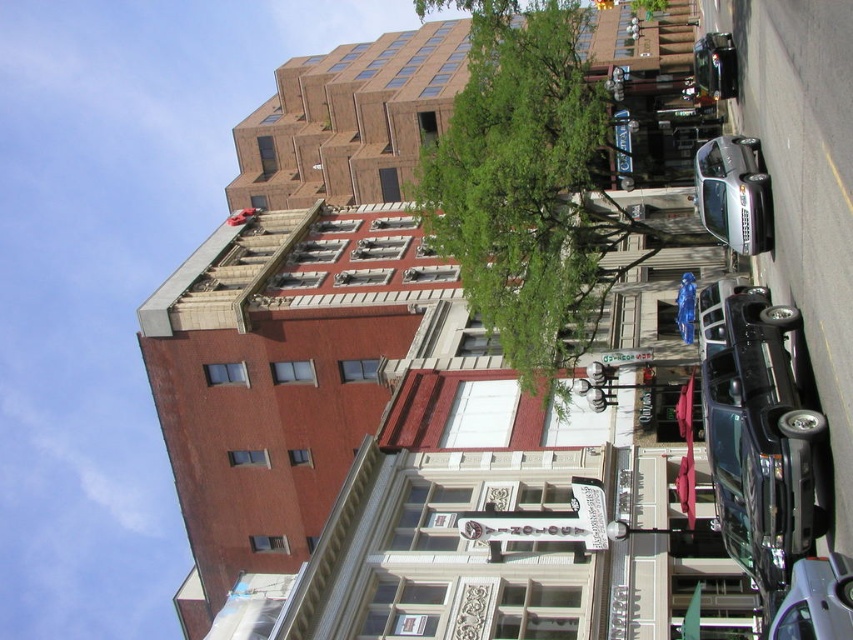
Question: Based on their relative distances, which object is nearer to the shiny black car at right?

Choices:
 (A) green leafy tree at center
 (B) silver metallic sedan at right

Answer: (B)

Question: Is shiny black car at right positioned before metallic silver sedan at lower right?

Choices:
 (A) no
 (B) yes

Answer: (A)

Question: Is green leafy tree at center to the left of shiny black car at right from the viewer's perspective?

Choices:
 (A) yes
 (B) no

Answer: (A)

Question: Which point is farther to the camera?

Choices:
 (A) (846, 602)
 (B) (722, 408)
 (C) (554, 164)

Answer: (C)

Question: Can you confirm if green leafy tree at center is positioned below metallic silver sedan at lower right?

Choices:
 (A) no
 (B) yes

Answer: (A)

Question: Which object is positioned farthest from the metallic silver sedan at lower right?

Choices:
 (A) silver metallic sedan at right
 (B) green leafy tree at center
 (C) shiny black car at right

Answer: (B)